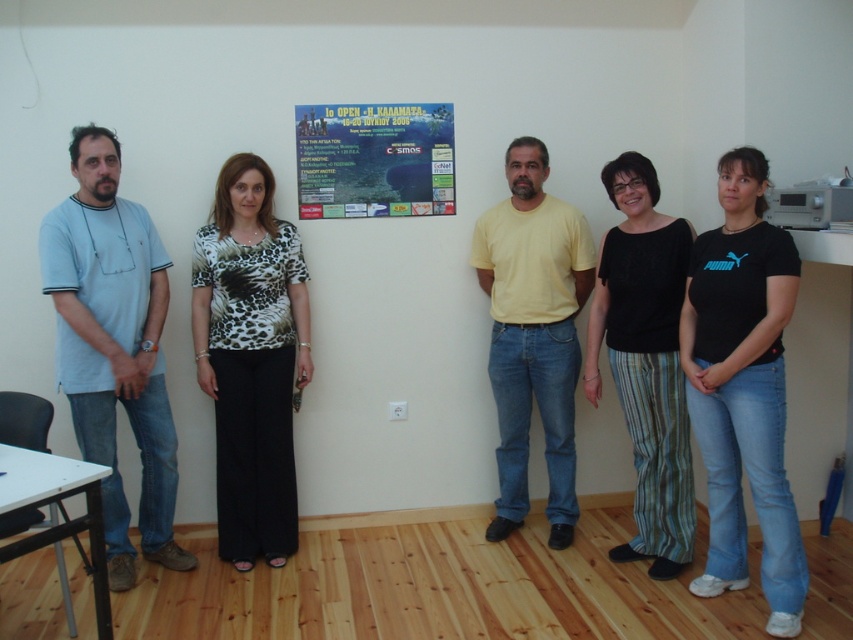
Consider the image. Does light blue cotton shirt at left appear on the right side of blue glossy poster at center?

Incorrect, light blue cotton shirt at left is not on the right side of blue glossy poster at center.

Is point (165, 304) closer to viewer compared to point (393, 108)?

Yes, point (165, 304) is closer to viewer.

Where is `light blue cotton shirt at left`? Image resolution: width=853 pixels, height=640 pixels. light blue cotton shirt at left is located at coordinates (113, 346).

The height and width of the screenshot is (640, 853). Identify the location of leopard print blouse at center. (250, 358).

Which is in front, point (109, 264) or point (618, 276)?

Point (109, 264)

Looking at this image, how much distance is there between light blue cotton shirt at left and black textured pants at center?

light blue cotton shirt at left and black textured pants at center are 1.77 meters apart.

The width and height of the screenshot is (853, 640). I want to click on light blue cotton shirt at left, so click(113, 346).